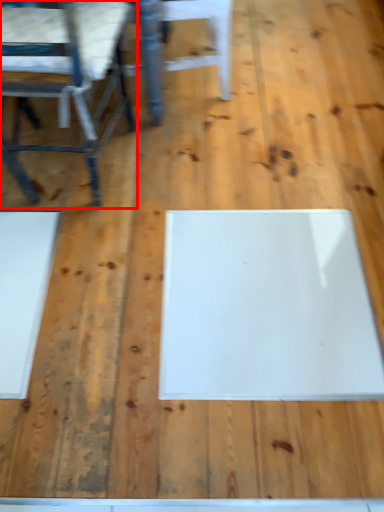
Question: From the image's perspective, considering the relative positions of chair (annotated by the red box) and chair in the image provided, where is chair (annotated by the red box) located with respect to the staircase?

Choices:
 (A) below
 (B) above

Answer: (A)